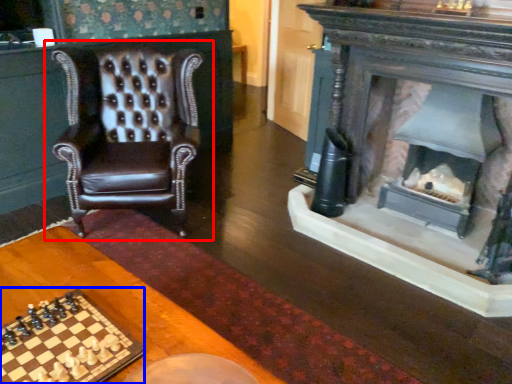
Question: Which of the following is the closest to the observer, chair (highlighted by a red box) or board game (highlighted by a blue box)?

Choices:
 (A) chair
 (B) board game

Answer: (B)